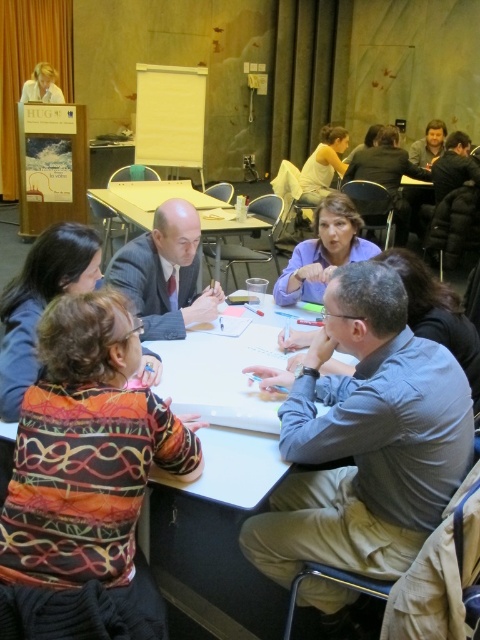
You are a photographer standing at the back of the room. You want to take a photo of the matte black suit at center and the matte white shirt at upper left. Based on their heights, which one is more likely to be visible in the photo if you position your camera at eye level?

The matte black suit at center is taller than the matte white shirt at upper left, so it is more likely to be visible in the photo when the camera is positioned at eye level.

You are standing in the conference room and want to reach the point marked at coordinates (194, 250). If you can walk 10 feet in 1 minute, how long will it take you to reach that point?

The point marked at coordinates (194, 250) is 7.92 feet away from the camera. Since you can walk 10 feet in 1 minute, it will take approximately 0.792 minutes, which is about 48 seconds, to reach that point.